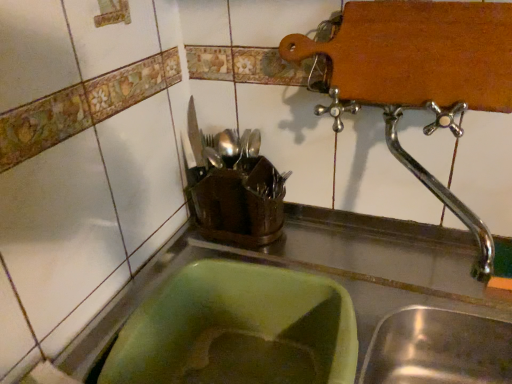
Question: Considering the positions of shiny silver cutlery at center, the 1th tableware from the right, and green plastic sink at lower left in the image, is shiny silver cutlery at center, the 1th tableware from the right, taller or shorter than green plastic sink at lower left?

Choices:
 (A) short
 (B) tall

Answer: (A)

Question: From the image's perspective, is shiny silver cutlery at center, marked as the 2th tableware in a left-to-right arrangement, located above or below green plastic sink at lower left?

Choices:
 (A) below
 (B) above

Answer: (B)

Question: Estimate the real-world distances between objects in this image. Which object is closer to the green plastic sink at lower left?

Choices:
 (A) shiny silver cutlery at center, the 1th tableware from the right
 (B) metallic knife at upper center, which ranks as the 2th tableware in right-to-left order
 (C) polished chrome tap at upper right

Answer: (C)

Question: Considering the real-world distances, which object is farthest from the polished chrome tap at upper right?

Choices:
 (A) metallic knife at upper center, which ranks as the 2th tableware in right-to-left order
 (B) green plastic sink at lower left
 (C) shiny silver cutlery at center, marked as the 2th tableware in a left-to-right arrangement

Answer: (A)